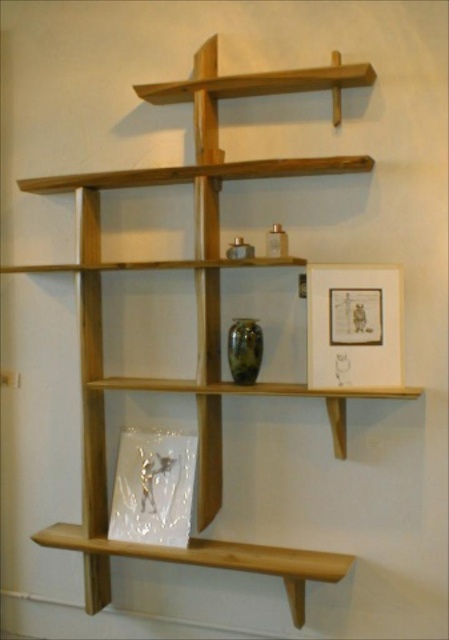
Does point (350, 371) come closer to viewer compared to point (175, 563)?

Yes.

Find the location of a particular element. The width and height of the screenshot is (449, 640). matte white picture frame at upper right is located at coordinates pos(353,326).